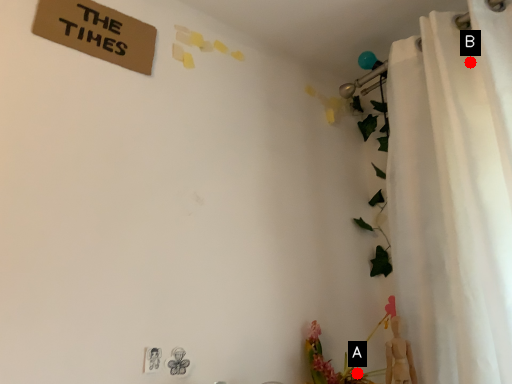
Question: Two points are circled on the image, labeled by A and B beside each circle. Which point is closer to the camera taking this photo?

Choices:
 (A) A is closer
 (B) B is closer

Answer: (B)